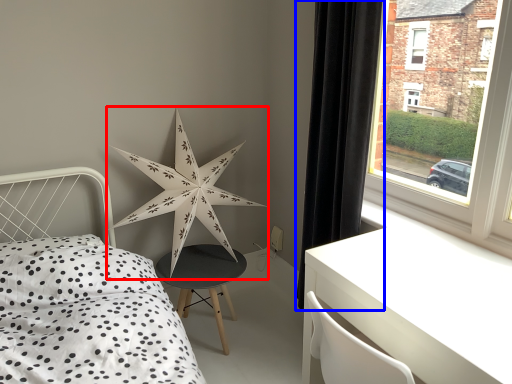
Question: Which point is further to the camera, star (highlighted by a red box) or curtain (highlighted by a blue box)?

Choices:
 (A) star
 (B) curtain

Answer: (A)